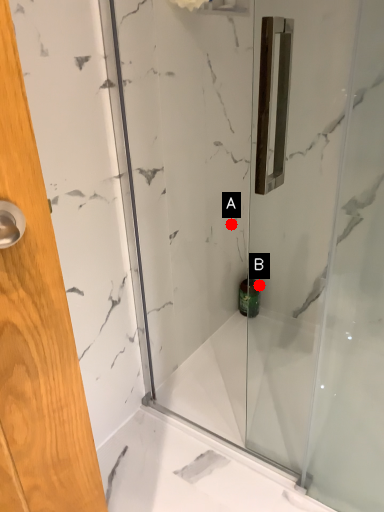
Question: Two points are circled on the image, labeled by A and B beside each circle. Which point appears farthest from the camera in this image?

Choices:
 (A) A is further
 (B) B is further

Answer: (B)